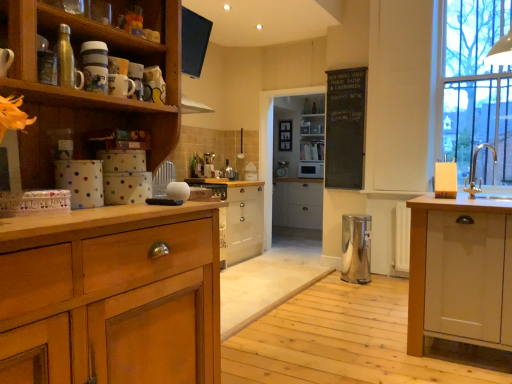
Question: In which direction should I rotate to look at white glossy microwave at center, arranged as the third appliance when ordered from the bottom?

Choices:
 (A) left
 (B) right

Answer: (B)

Question: Is wooden cabinet at center, the second cabinetry positioned from the right, oriented towards black chalkboard at upper center?

Choices:
 (A) yes
 (B) no

Answer: (B)

Question: From a real-world perspective, is wooden cabinet at center, the second cabinetry positioned from the right, located higher than black chalkboard at upper center?

Choices:
 (A) no
 (B) yes

Answer: (A)

Question: Is wooden cabinet at center, the 1th cabinetry from the left, bigger than black chalkboard at upper center?

Choices:
 (A) yes
 (B) no

Answer: (A)

Question: Is black chalkboard at upper center completely or partially inside wooden cabinet at center, the second cabinetry positioned from the right?

Choices:
 (A) yes
 (B) no

Answer: (B)

Question: Can you confirm if wooden cabinet at center, the 1th cabinetry from the left, is thinner than black chalkboard at upper center?

Choices:
 (A) no
 (B) yes

Answer: (A)

Question: Does wooden cabinet at center, the 1th cabinetry from the left, appear on the right side of black chalkboard at upper center?

Choices:
 (A) yes
 (B) no

Answer: (B)

Question: Can you confirm if white glossy toaster at center, which is counted as the 2th appliance, starting from the left, is bigger than white glossy sink at right?

Choices:
 (A) no
 (B) yes

Answer: (A)

Question: Could white glossy sink at right be considered to be inside white glossy toaster at center, which is counted as the second appliance, starting from the bottom?

Choices:
 (A) yes
 (B) no

Answer: (B)

Question: Is white glossy toaster at center, placed as the third appliance when sorted from front to back, looking in the opposite direction of white glossy sink at right?

Choices:
 (A) yes
 (B) no

Answer: (B)

Question: Considering the relative positions of white glossy toaster at center, placed as the third appliance when sorted from front to back, and white glossy sink at right in the image provided, is white glossy toaster at center, placed as the third appliance when sorted from front to back, to the right of white glossy sink at right from the viewer's perspective?

Choices:
 (A) yes
 (B) no

Answer: (B)

Question: Can you confirm if white glossy toaster at center, which is counted as the second appliance, starting from the bottom, is smaller than white glossy sink at right?

Choices:
 (A) no
 (B) yes

Answer: (B)

Question: Is the surface of white glossy toaster at center, which is counted as the second appliance, starting from the bottom, in direct contact with white glossy sink at right?

Choices:
 (A) no
 (B) yes

Answer: (A)

Question: Can you confirm if metallic silver water bottle at upper left, which ranks as the fourth appliance in bottom-to-top order, is taller than silver metallic sink at right?

Choices:
 (A) no
 (B) yes

Answer: (A)